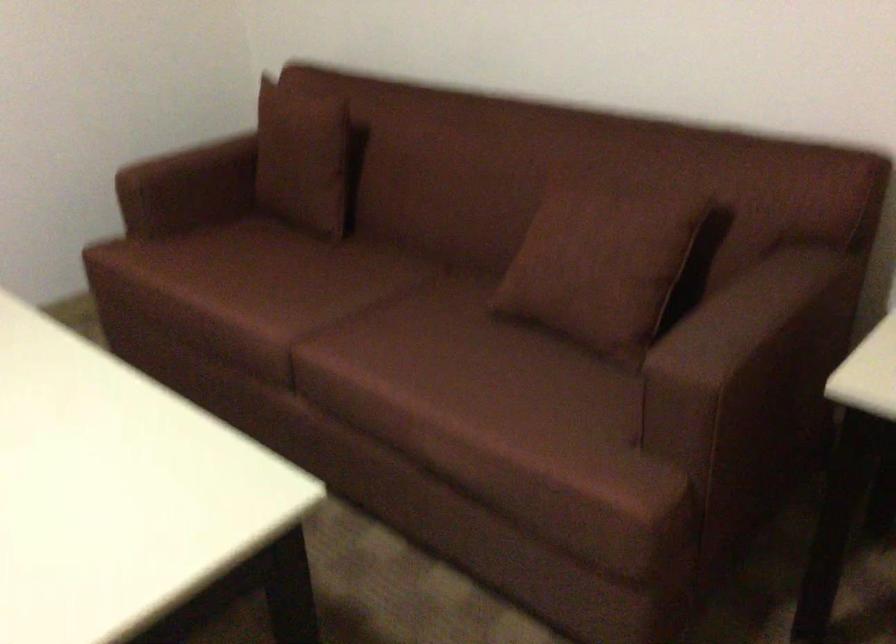
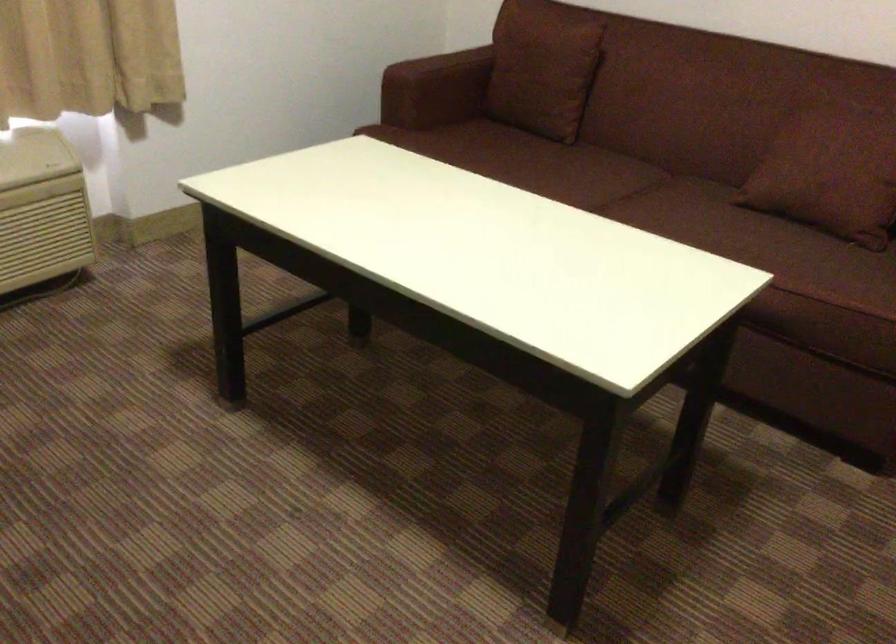
In the second image, find the point that corresponds to point (588, 327) in the first image.

(842, 207)